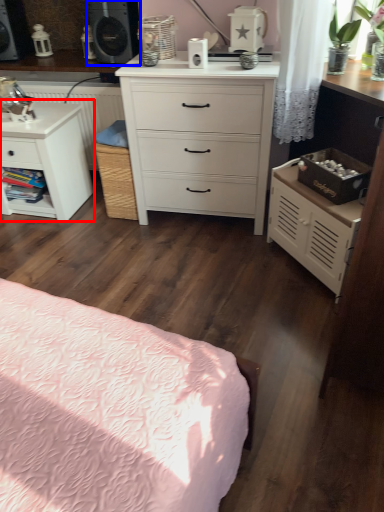
Question: Among these objects, which one is farthest to the camera, nightstand (highlighted by a red box) or speaker (highlighted by a blue box)?

Choices:
 (A) nightstand
 (B) speaker

Answer: (B)